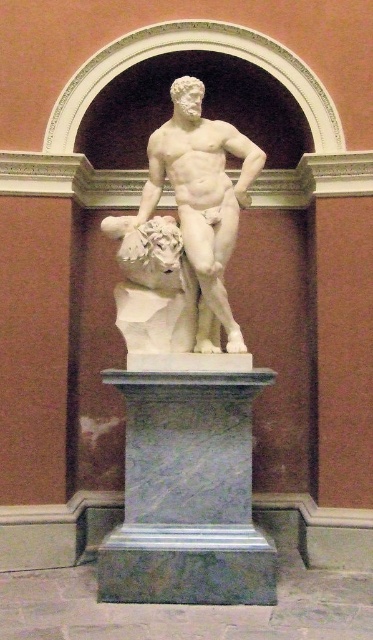
Question: Observing the image, what is the correct spatial positioning of gray marble pedestal at center in reference to white marble statue at center?

Choices:
 (A) left
 (B) right

Answer: (B)

Question: Which point is closer to the camera?

Choices:
 (A) (164, 572)
 (B) (246, 186)

Answer: (A)

Question: Which of the following is the farthest from the observer?

Choices:
 (A) (167, 170)
 (B) (108, 547)

Answer: (A)

Question: Does gray marble pedestal at center have a smaller size compared to white marble statue at center?

Choices:
 (A) no
 (B) yes

Answer: (B)

Question: Does gray marble pedestal at center have a larger size compared to white marble statue at center?

Choices:
 (A) yes
 (B) no

Answer: (B)